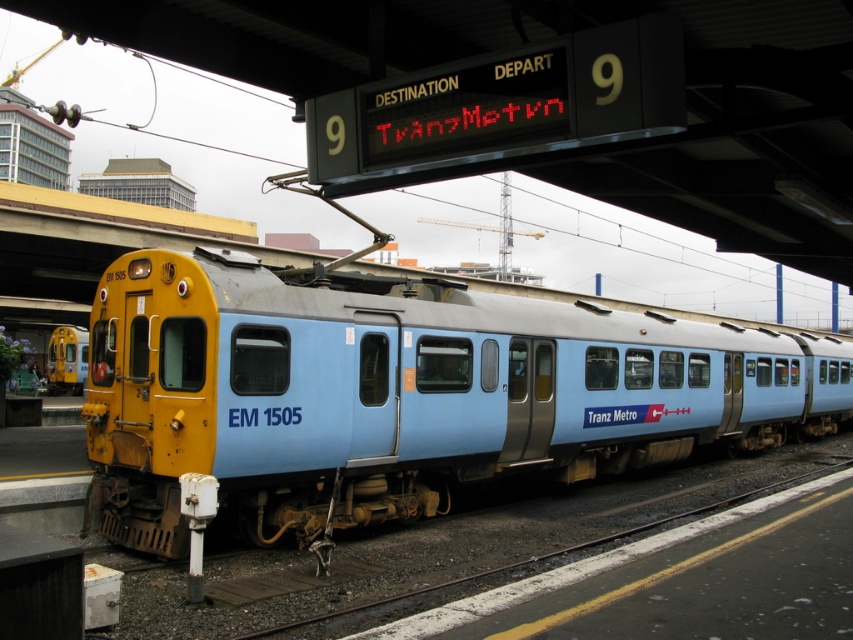
Question: Which point is farther to the camera?

Choices:
 (A) matte blue train at center
 (B) yellow matte train at left

Answer: (B)

Question: Among these points, which one is farthest from the camera?

Choices:
 (A) (172, 380)
 (B) (54, 364)

Answer: (B)

Question: Does matte blue train at center have a lesser width compared to yellow matte train at left?

Choices:
 (A) yes
 (B) no

Answer: (B)

Question: Where is matte blue train at center located in relation to yellow matte train at left in the image?

Choices:
 (A) left
 (B) right

Answer: (B)

Question: Is matte blue train at center to the left of yellow matte train at left from the viewer's perspective?

Choices:
 (A) yes
 (B) no

Answer: (B)